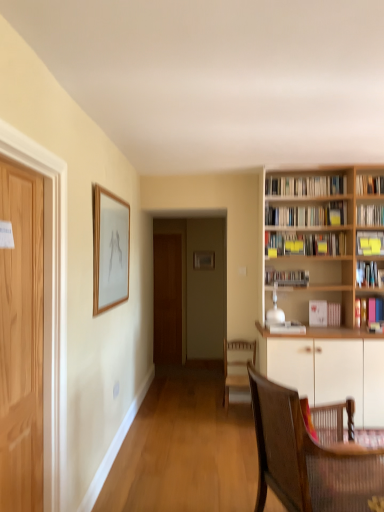
At what (x,y) coordinates should I click in order to perform the action: click on vacant space in front of white paper book at right, arranged as the second book when ordered from the bottom. Please return your answer as a coordinate pair (x, y). Looking at the image, I should click on (338, 325).